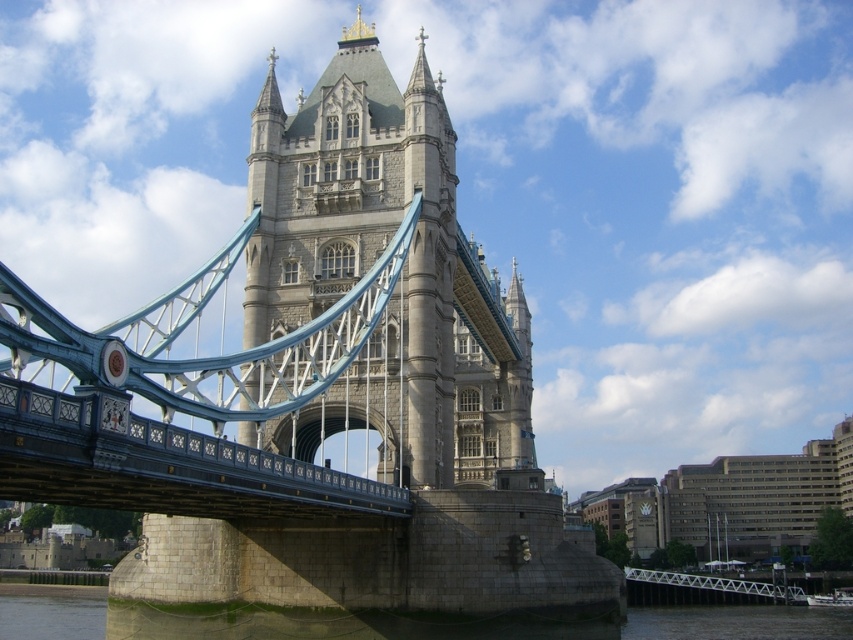
You are standing on the Thames River embankment and see the stone suspension bridge at center and the gray stone river at lower center. Which object is closer to you?

The stone suspension bridge at center is closer to you because it is in front of the gray stone river at lower center.

You are a tourist standing on the bank of the gray stone river at lower center. You want to cross to the other side. Is the stone suspension bridge at center a viable option for crossing the river?

The stone suspension bridge at center is above gray stone river at lower center, so yes, the bridge is positioned over the river and can be used to cross it.

You are a tourist standing on the Thames River bank and want to take a photo of both the gray stone tower at center and the white metallic bridge at lower right. Which object should you focus on first if you want to include both in your frame without zooming in?

You should focus on the gray stone tower at center first because it is larger in size compared to the white metallic bridge at lower right, so it will occupy more space in the photo and ensure both are visible without zooming.